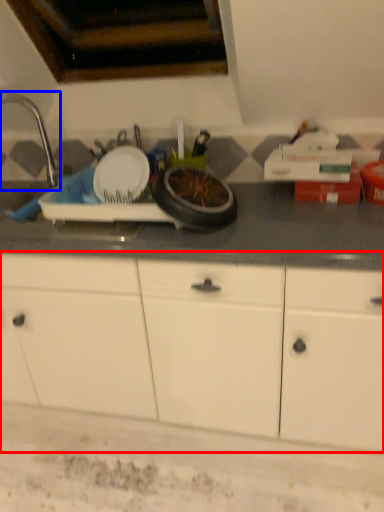
Question: Which of the following is the closest to the observer, cabinetry (highlighted by a red box) or faucet (highlighted by a blue box)?

Choices:
 (A) cabinetry
 (B) faucet

Answer: (A)